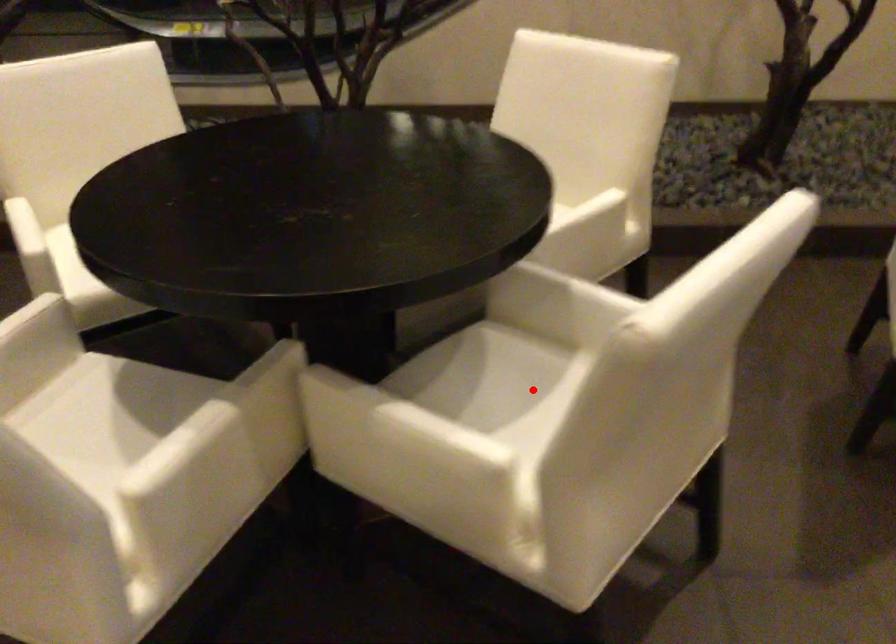
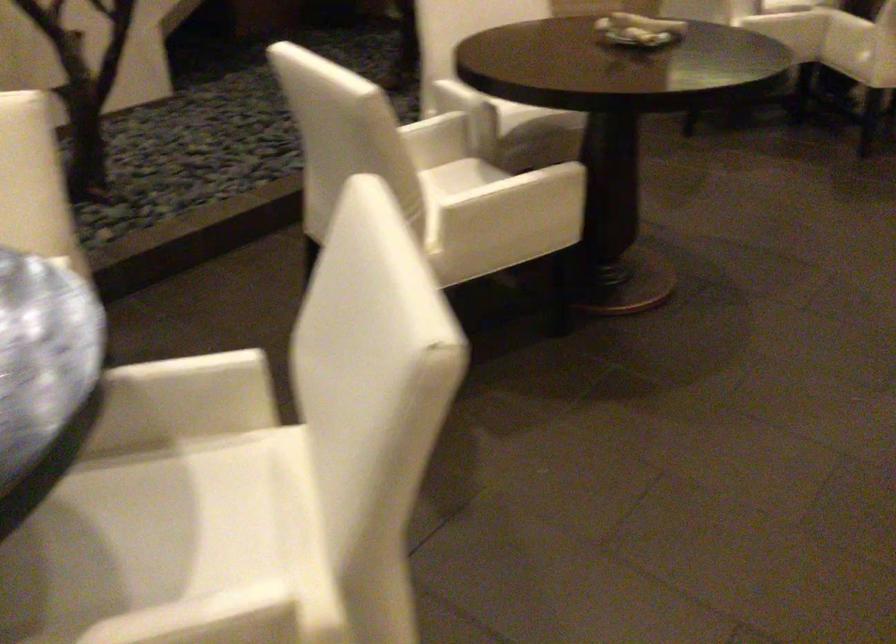
The point at the highlighted location is marked in the first image. Where is the corresponding point in the second image?

(177, 514)